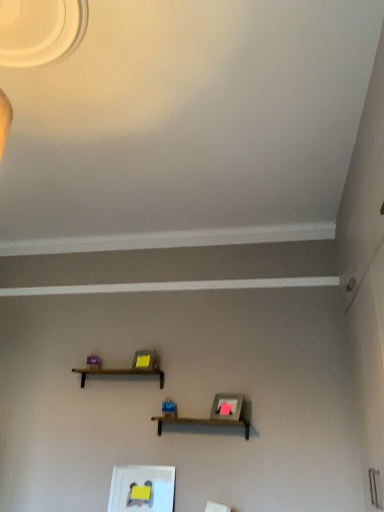
Question: Is brown wooden shelf at center taller than matte white picture frame at lower center?

Choices:
 (A) no
 (B) yes

Answer: (A)

Question: Can you confirm if brown wooden shelf at center is positioned to the right of matte white picture frame at lower center?

Choices:
 (A) yes
 (B) no

Answer: (B)

Question: From the image's perspective, is brown wooden shelf at center below matte white picture frame at lower center?

Choices:
 (A) yes
 (B) no

Answer: (B)

Question: Is brown wooden shelf at center facing towards matte white picture frame at lower center?

Choices:
 (A) no
 (B) yes

Answer: (A)

Question: Is brown wooden shelf at center closer to camera compared to matte white picture frame at lower center?

Choices:
 (A) no
 (B) yes

Answer: (A)

Question: Does brown wooden shelf at center come behind matte white picture frame at lower center?

Choices:
 (A) no
 (B) yes

Answer: (B)

Question: Is matte white picture frame at lower center to the right of brown wooden shelf at center from the viewer's perspective?

Choices:
 (A) yes
 (B) no

Answer: (A)

Question: Is matte white picture frame at lower center facing towards brown wooden shelf at center?

Choices:
 (A) no
 (B) yes

Answer: (A)

Question: Is matte white picture frame at lower center further to camera compared to brown wooden shelf at center?

Choices:
 (A) yes
 (B) no

Answer: (B)

Question: Can you confirm if matte white picture frame at lower center is shorter than brown wooden shelf at center?

Choices:
 (A) yes
 (B) no

Answer: (B)

Question: From the image's perspective, is matte white picture frame at lower center above brown wooden shelf at center?

Choices:
 (A) yes
 (B) no

Answer: (B)

Question: Considering the relative sizes of matte white picture frame at lower center and brown wooden shelf at center in the image provided, is matte white picture frame at lower center bigger than brown wooden shelf at center?

Choices:
 (A) yes
 (B) no

Answer: (B)

Question: In terms of height, does matte white picture frame at lower center look taller or shorter compared to brown wooden shelf at center?

Choices:
 (A) tall
 (B) short

Answer: (A)